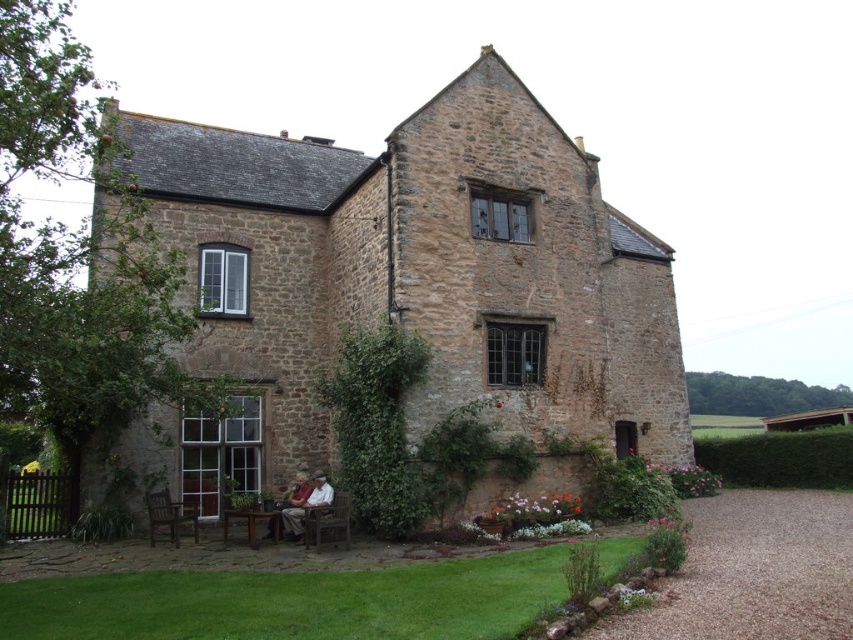
Question: From the image, what is the correct spatial relationship of green grass at lower center in relation to brown wooden bench at lower center?

Choices:
 (A) left
 (B) right

Answer: (B)

Question: Estimate the real-world distances between objects in this image. Which object is closer to the white textured shirt at center?

Choices:
 (A) brown wooden bench at lower center
 (B) green grass at lower center
 (C) brown wooden park bench at lower center
 (D) dark brown wooden bench at lower left

Answer: (C)

Question: Can you confirm if brown wooden bench at lower center is positioned to the left of white textured shirt at center?

Choices:
 (A) yes
 (B) no

Answer: (B)

Question: Among these objects, which one is farthest from the camera?

Choices:
 (A) brown wooden park bench at lower center
 (B) dark brown wooden bench at lower left
 (C) green grass at lower center

Answer: (B)

Question: Is dark brown wooden bench at lower left above matte brown jacket at lower center?

Choices:
 (A) yes
 (B) no

Answer: (B)

Question: Which is nearer to the brown wooden bench at lower center?

Choices:
 (A) matte brown jacket at lower center
 (B) dark brown wooden bench at lower left
 (C) brown wooden park bench at lower center
 (D) white textured shirt at center

Answer: (D)